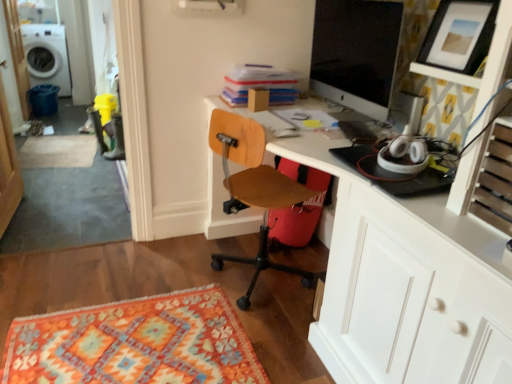
You are a GUI agent. You are given a task and a screenshot of the screen. Output one action in this format:
    pyautogui.click(x=<x>, y=<y>)
    Task: Click on the free space above textured woolen rug at lower left, the 1th mat in the bottom-to-top sequence (from a real-world perspective)
    This screenshot has height=384, width=512.
    Given the screenshot: What is the action you would take?
    pyautogui.click(x=134, y=338)